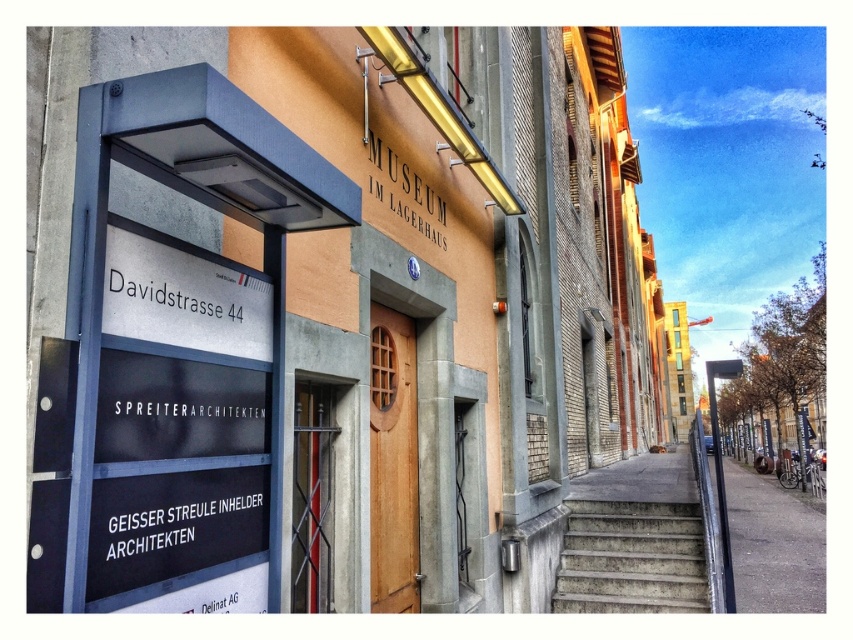
Question: Is black plastic sign at left bigger than concrete stairs at lower right?

Choices:
 (A) no
 (B) yes

Answer: (A)

Question: Is black plastic sign at left smaller than concrete stairs at lower right?

Choices:
 (A) yes
 (B) no

Answer: (A)

Question: Estimate the real-world distances between objects in this image. Which object is farther from the concrete stairs at lower right?

Choices:
 (A) black plastic sign at left
 (B) metallic pole at right

Answer: (A)

Question: Estimate the real-world distances between objects in this image. Which object is closer to the metallic pole at right?

Choices:
 (A) concrete stairs at lower right
 (B) black plastic sign at left

Answer: (A)

Question: Can you confirm if black plastic sign at left is positioned below concrete stairs at lower right?

Choices:
 (A) no
 (B) yes

Answer: (A)

Question: Which object appears closest to the camera in this image?

Choices:
 (A) concrete stairs at lower right
 (B) metallic pole at right
 (C) black plastic sign at left

Answer: (C)